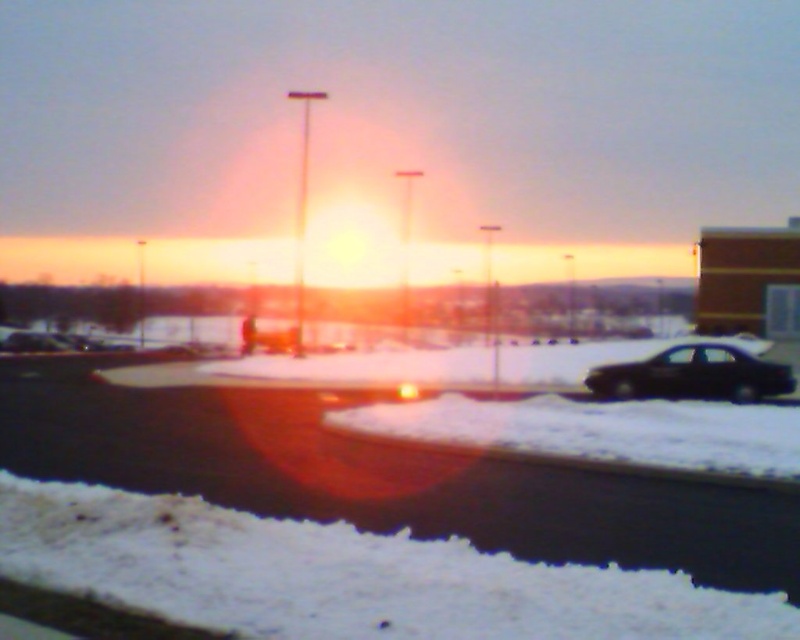
You are a delivery person trying to park your vehicle in the parking lot. You see the white fluffy snow at lower left and the black matte car at right. Which area has enough space to park your car?

The black matte car at right has more width than the white fluffy snow at lower left, so the area near the black matte car at right might have enough space to park your car.

Looking at this image, you are standing in the winter scene and want to walk from the point closer to you to the point further away. Which path would you take between the two points, point (137, 547) and point (664, 384)?

The path from point (137, 547) to point (664, 384) would go from the closer point to the further one since point (137, 547) is closer to the viewer than point (664, 384).